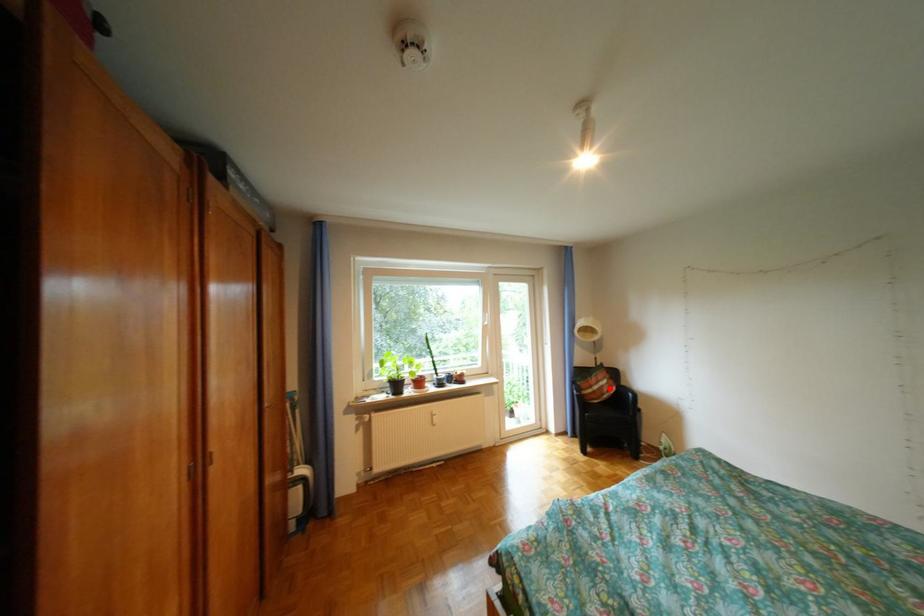
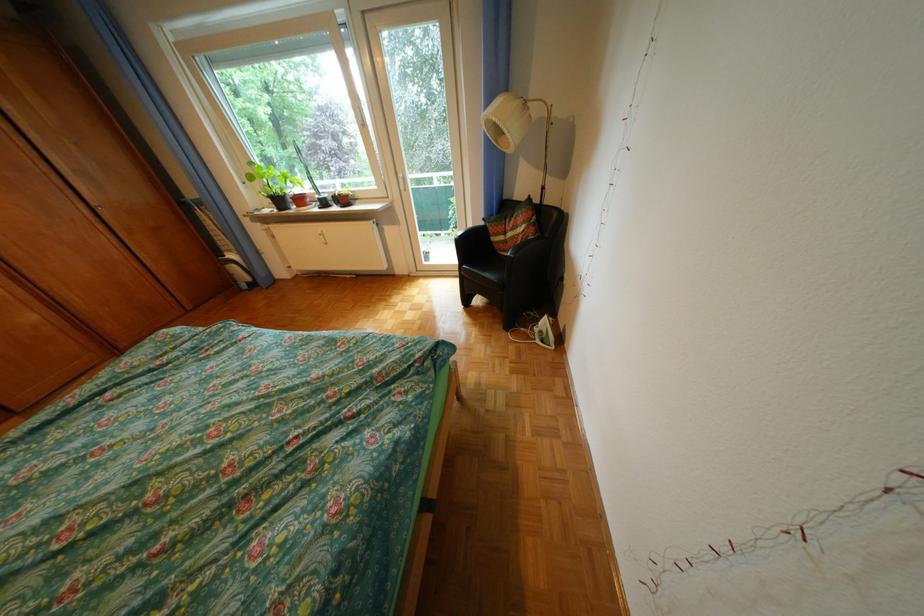
Question: I am providing you with two images of the same scene from different viewpoints. Given a red point in image1, look at the same physical point in image2. Is it:

Choices:
 (A) Closer to the viewpoint
 (B) Farther from the viewpoint

Answer: (A)